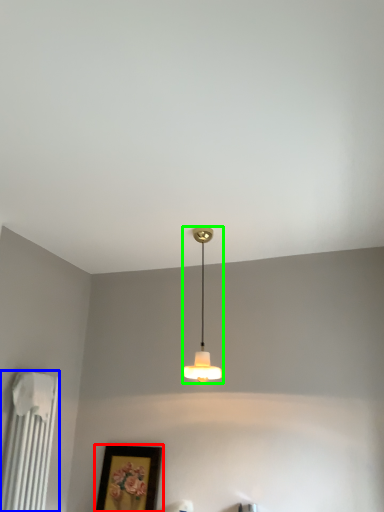
Question: Which object is the farthest from picture frame (highlighted by a red box)? Choose among these: radiator (highlighted by a blue box) or lamp (highlighted by a green box).

Choices:
 (A) radiator
 (B) lamp

Answer: (B)